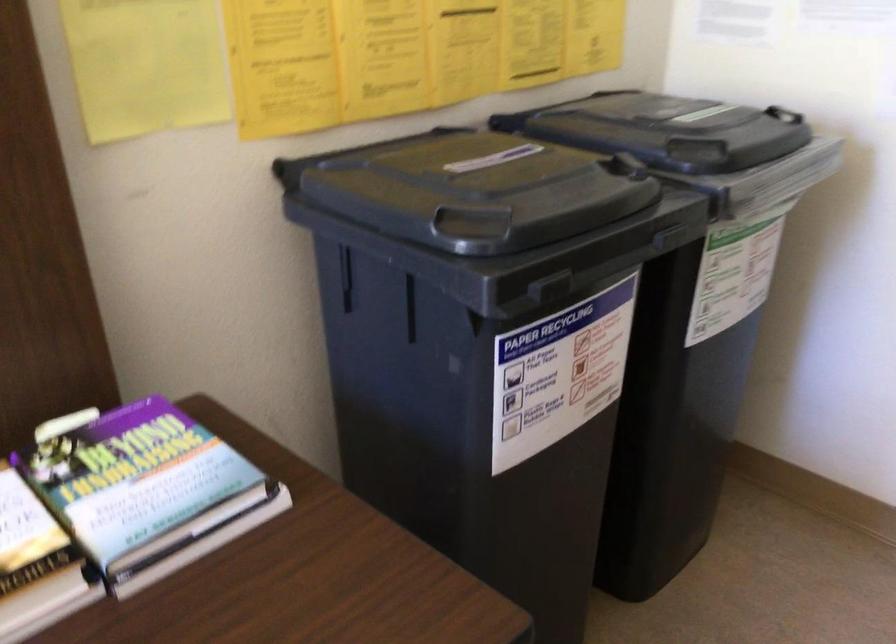
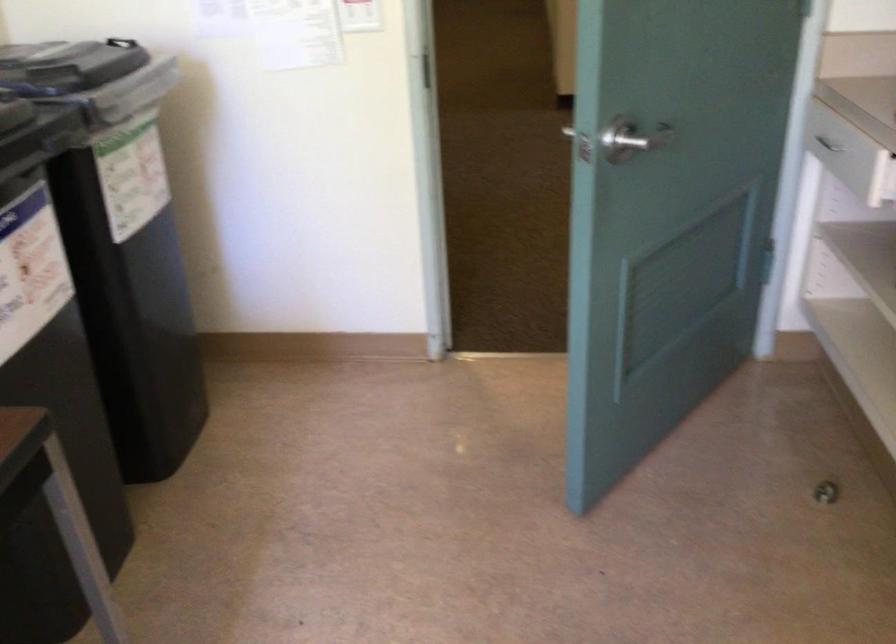
Question: The camera is either moving clockwise (left) or counter-clockwise (right) around the object. The first image is from the beginning of the video and the second image is from the end. Is the camera moving left or right when shooting the video?

Choices:
 (A) Left
 (B) Right

Answer: (A)